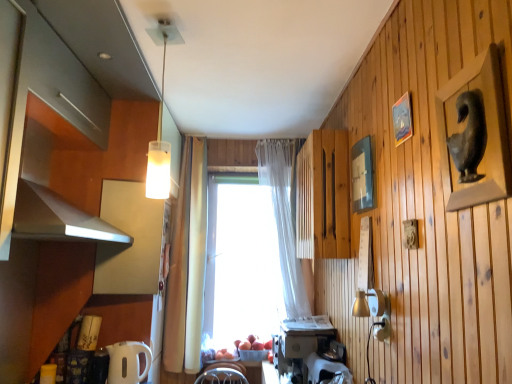
What do you see at coordinates (127, 362) in the screenshot?
I see `white glossy electric kettle at lower left, which ranks as the 3th appliance in right-to-left order` at bounding box center [127, 362].

You are a GUI agent. You are given a task and a screenshot of the screen. Output one action in this format:
    pyautogui.click(x=<x>, y=<y>)
    Task: Click on the transparent glass window at center
    The height and width of the screenshot is (384, 512).
    Given the screenshot: What is the action you would take?
    pyautogui.click(x=241, y=263)

Locate an element on the screen. The image size is (512, 384). wooden picture frame at upper right, positioned as the 1th picture frame in back-to-front order is located at coordinates (362, 176).

Is wooden picture frame at upper right, the 2th picture frame when ordered from front to back, facing away from wooden slats at center, the third cabinetry in the left-to-right sequence?

No, wooden picture frame at upper right, the 2th picture frame when ordered from front to back, is not facing away from wooden slats at center, the third cabinetry in the left-to-right sequence.

From the image's perspective, starting from the wooden slats at center, the third cabinetry in the left-to-right sequence, which picture frame is the 3rd one above? Please provide its 2D coordinates.

[(402, 119)]

Between wooden picture frame at upper right, the 2th picture frame when ordered from front to back, and wooden slats at center, acting as the 1th cabinetry starting from the right, which one has less height?

wooden picture frame at upper right, the 2th picture frame when ordered from front to back, is shorter.

Is white plastic toaster at lower center, which appears as the 3th appliance when viewed from the left, inside the boundaries of matte gray statue at upper right, the first picture frame when ordered from front to back, or outside?

white plastic toaster at lower center, which appears as the 3th appliance when viewed from the left, lies outside matte gray statue at upper right, the first picture frame when ordered from front to back.

Can you confirm if white plastic toaster at lower center, which appears as the 3th appliance when viewed from the left, is thinner than matte gray statue at upper right, the third picture frame when ordered from back to front?

No.

From the picture: In terms of size, does white plastic toaster at lower center, which is the 1th appliance in right-to-left order, appear bigger or smaller than matte gray statue at upper right, the first picture frame when ordered from front to back?

white plastic toaster at lower center, which is the 1th appliance in right-to-left order, is bigger than matte gray statue at upper right, the first picture frame when ordered from front to back.

Considering the sizes of white plastic toaster at lower center, which appears as the 3th appliance when viewed from the left, and matte gray statue at upper right, the third picture frame when ordered from back to front, in the image, is white plastic toaster at lower center, which appears as the 3th appliance when viewed from the left, taller or shorter than matte gray statue at upper right, the third picture frame when ordered from back to front,?

Considering their sizes, white plastic toaster at lower center, which appears as the 3th appliance when viewed from the left, has less height than matte gray statue at upper right, the third picture frame when ordered from back to front.

Which object is wider, transparent glass window at center or translucent fabric curtain at center?

Wider between the two is translucent fabric curtain at center.

From a real-world perspective, who is located lower, transparent glass window at center or translucent fabric curtain at center?

In real-world perspective, transparent glass window at center is lower.

Measure the distance from transparent glass window at center to translucent fabric curtain at center.

transparent glass window at center is 15.59 inches from translucent fabric curtain at center.

Is translucent fabric curtain at center a part of transparent glass window at center?

No, translucent fabric curtain at center is not a part of transparent glass window at center.

From the picture: Is white glossy electric kettle at lower left, which appears as the first appliance when viewed from the left, beside translucent glass pendant light at upper center?

No, white glossy electric kettle at lower left, which appears as the first appliance when viewed from the left, is not beside translucent glass pendant light at upper center.

From the image's perspective, which one is positioned higher, white glossy electric kettle at lower left, which ranks as the 3th appliance in right-to-left order, or translucent glass pendant light at upper center?

translucent glass pendant light at upper center, from the image's perspective.

Is white glossy electric kettle at lower left, which appears as the first appliance when viewed from the left, facing away from translucent glass pendant light at upper center?

No, white glossy electric kettle at lower left, which appears as the first appliance when viewed from the left,'s orientation is not away from translucent glass pendant light at upper center.

Who is bigger, white glossy electric kettle at lower left, which appears as the first appliance when viewed from the left, or translucent glass pendant light at upper center?

translucent glass pendant light at upper center is bigger.

How many degrees apart are the facing directions of wooden picture frame at upper right, the 3th picture frame when ordered from front to back, and translucent glass pendant light at upper center?

There is a 82.5-degree angle between the facing directions of wooden picture frame at upper right, the 3th picture frame when ordered from front to back, and translucent glass pendant light at upper center.

Does wooden picture frame at upper right, positioned as the 1th picture frame in back-to-front order, turn towards translucent glass pendant light at upper center?

Yes, wooden picture frame at upper right, positioned as the 1th picture frame in back-to-front order, is turned towards translucent glass pendant light at upper center.

Considering the sizes of objects wooden picture frame at upper right, positioned as the 1th picture frame in back-to-front order, and translucent glass pendant light at upper center in the image provided, who is thinner, wooden picture frame at upper right, positioned as the 1th picture frame in back-to-front order, or translucent glass pendant light at upper center?

wooden picture frame at upper right, positioned as the 1th picture frame in back-to-front order.

Is matte wood cabinet at upper left, the first cabinetry when ordered from left to right, aimed at white plastic coffee maker at lower center, which is the second appliance from left to right?

No, matte wood cabinet at upper left, the first cabinetry when ordered from left to right, is not facing towards white plastic coffee maker at lower center, which is the second appliance from left to right.

Which object is more forward, matte wood cabinet at upper left, which is the third cabinetry in right-to-left order, or white plastic coffee maker at lower center, acting as the 2th appliance starting from the right?

matte wood cabinet at upper left, which is the third cabinetry in right-to-left order.

Can you tell me how much matte wood cabinet at upper left, which is the third cabinetry in right-to-left order, and white plastic coffee maker at lower center, which is the second appliance from left to right, differ in facing direction?

179 degrees separate the facing orientations of matte wood cabinet at upper left, which is the third cabinetry in right-to-left order, and white plastic coffee maker at lower center, which is the second appliance from left to right.

Is matte wood cabinet at upper left, which is the third cabinetry in right-to-left order, beside white plastic coffee maker at lower center, acting as the 2th appliance starting from the right?

No.

Can you confirm if white plastic toaster at lower center, which is the 1th appliance in right-to-left order, is shorter than translucent fabric curtain at center?

Yes.

Is translucent fabric curtain at center at the back of white plastic toaster at lower center, which is the 1th appliance in right-to-left order?

No.

Considering the relative positions of white plastic toaster at lower center, which is the 1th appliance in right-to-left order, and translucent fabric curtain at center in the image provided, is white plastic toaster at lower center, which is the 1th appliance in right-to-left order, behind translucent fabric curtain at center?

No, the depth of white plastic toaster at lower center, which is the 1th appliance in right-to-left order, is less than that of translucent fabric curtain at center.

The image size is (512, 384). I want to click on the 1st cabinetry counting from the left of the wooden picture frame at upper right, which is the second picture frame from back to front, so click(x=323, y=196).

From a real-world perspective, which picture frame is the 1st one above the white plastic toaster at lower center, which appears as the 3th appliance when viewed from the left? Please provide its 2D coordinates.

[(474, 134)]

Considering their positions, is matte white cabinet at left, acting as the 2th cabinetry starting from the right, positioned closer to matte wood cabinet at upper left, the first cabinetry when ordered from left to right, than white glossy electric kettle at lower left, which ranks as the 3th appliance in right-to-left order?

matte white cabinet at left, acting as the 2th cabinetry starting from the right.

Looking at the image, which one is located closer to matte white cabinet at left, the second cabinetry when ordered from left to right, white plastic coffee maker at lower center, acting as the 2th appliance starting from the right, or white glossy electric kettle at lower left, which ranks as the 3th appliance in right-to-left order?

Among the two, white glossy electric kettle at lower left, which ranks as the 3th appliance in right-to-left order, is located nearer to matte white cabinet at left, the second cabinetry when ordered from left to right.

In the scene shown: Based on their spatial positions, is matte gray statue at upper right, the first picture frame when ordered from front to back, or white plastic toaster at lower center, which is the 1th appliance in right-to-left order, closer to matte white cabinet at left, acting as the 2th cabinetry starting from the right?

white plastic toaster at lower center, which is the 1th appliance in right-to-left order.

Considering their positions, is wooden slats at center, acting as the 1th cabinetry starting from the right, positioned closer to transparent glass window at center than translucent glass pendant light at upper center?

The object closer to transparent glass window at center is wooden slats at center, acting as the 1th cabinetry starting from the right.

Which object lies nearer to the anchor point translucent fabric curtain at center, wooden picture frame at upper right, which is the second picture frame from back to front, or matte wood cabinet at upper left, the first cabinetry when ordered from left to right?

matte wood cabinet at upper left, the first cabinetry when ordered from left to right, is closer to translucent fabric curtain at center.

Based on their spatial positions, is matte wood cabinet at upper left, which is the third cabinetry in right-to-left order, or transparent glass window at center further from wooden picture frame at upper right, the 3th picture frame when ordered from front to back?

Based on the image, transparent glass window at center appears to be further to wooden picture frame at upper right, the 3th picture frame when ordered from front to back.

When comparing their distances from translucent glass pendant light at upper center, does matte wood cabinet at upper left, which is the third cabinetry in right-to-left order, or white plastic toaster at lower center, which appears as the 3th appliance when viewed from the left, seem closer?

The object closer to translucent glass pendant light at upper center is matte wood cabinet at upper left, which is the third cabinetry in right-to-left order.

Estimate the real-world distances between objects in this image. Which object is further from white glossy electric kettle at lower left, which appears as the first appliance when viewed from the left, white plastic coffee maker at lower center, which is the second appliance from left to right, or matte wood cabinet at upper left, the first cabinetry when ordered from left to right?

matte wood cabinet at upper left, the first cabinetry when ordered from left to right, lies further to white glossy electric kettle at lower left, which appears as the first appliance when viewed from the left, than the other object.

Where is `appliance located between matte white cabinet at left, acting as the 2th cabinetry starting from the right, and translucent fabric curtain at center in the left-right direction`? The image size is (512, 384). appliance located between matte white cabinet at left, acting as the 2th cabinetry starting from the right, and translucent fabric curtain at center in the left-right direction is located at coordinates (127, 362).

Image resolution: width=512 pixels, height=384 pixels. I want to click on light fixture that lies between matte wood cabinet at upper left, the first cabinetry when ordered from left to right, and white plastic toaster at lower center, which appears as the 3th appliance when viewed from the left, from top to bottom, so (x=161, y=122).

I want to click on light fixture located between wooden picture frame at upper right, which is the second picture frame from back to front, and transparent glass window at center in the depth direction, so click(161, 122).

This screenshot has width=512, height=384. Identify the location of light fixture positioned between matte gray statue at upper right, the first picture frame when ordered from front to back, and wooden slats at center, acting as the 1th cabinetry starting from the right, from near to far. coord(161,122).